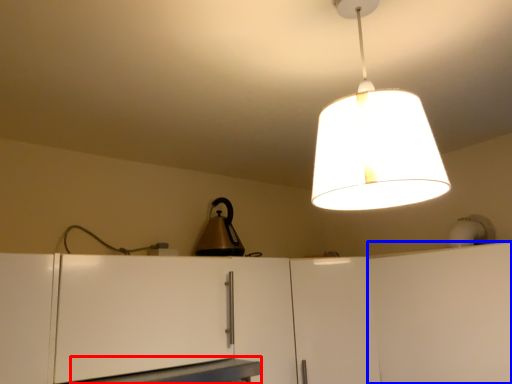
Question: Which object appears farthest to the camera in this image, table (highlighted by a red box) or cabinetry (highlighted by a blue box)?

Choices:
 (A) table
 (B) cabinetry

Answer: (B)